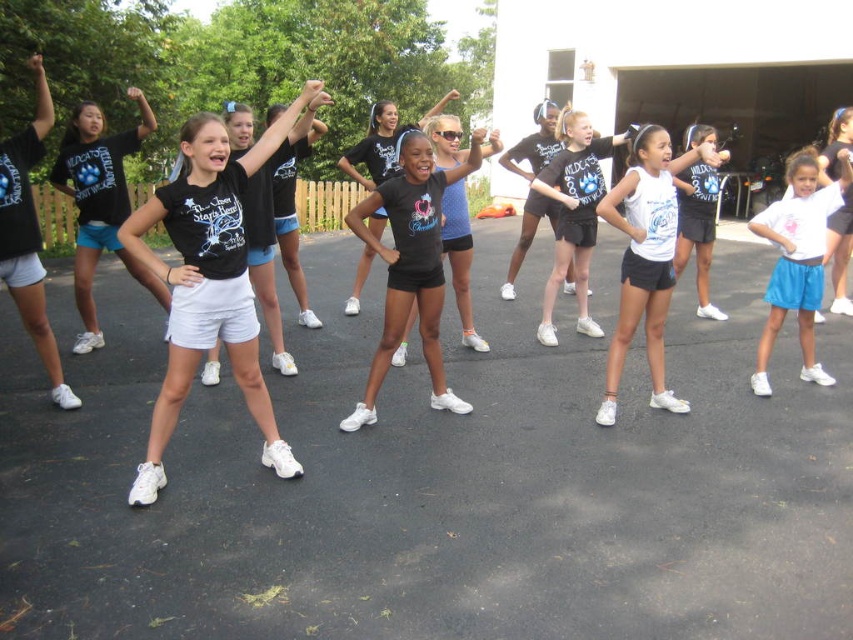
You are observing the girls in their practice session. Which clothing item is more to the left between the white cotton shirt at center and the white matte shorts at lower right?

The white cotton shirt at center is more to the left than the white matte shorts at lower right.